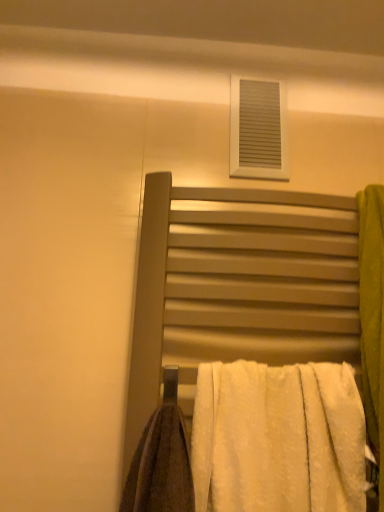
The image size is (384, 512). Identify the location of white matte vent at upper center. (258, 129).

Which is more to the left, matte metal towel rack at center or white fluffy towel at center?

matte metal towel rack at center is more to the left.

Consider the image. Are matte metal towel rack at center and white fluffy towel at center making contact?

They are not placed beside each other.

Which is behind, point (157, 368) or point (225, 474)?

Point (157, 368)

Considering the relative sizes of white matte vent at upper center and white fluffy towel at center in the image provided, is white matte vent at upper center wider than white fluffy towel at center?

Incorrect, the width of white matte vent at upper center does not surpass that of white fluffy towel at center.

From a real-world perspective, who is located lower, white matte vent at upper center or white fluffy towel at center?

white fluffy towel at center is physically lower.

This screenshot has height=512, width=384. Find the location of `window located above the white fluffy towel at center (from the image's perspective)`. window located above the white fluffy towel at center (from the image's perspective) is located at coordinates (258, 129).

In terms of height, does white matte vent at upper center look taller or shorter compared to white fluffy towel at center?

Clearly, white matte vent at upper center is shorter compared to white fluffy towel at center.

Does matte metal towel rack at center have a smaller size compared to white matte vent at upper center?

No, matte metal towel rack at center is not smaller than white matte vent at upper center.

Between matte metal towel rack at center and white matte vent at upper center, which one is positioned in front?

Positioned in front is matte metal towel rack at center.

Is matte metal towel rack at center not close to white matte vent at upper center?

No, matte metal towel rack at center is not far from white matte vent at upper center.

Does matte metal towel rack at center have a lesser width compared to white matte vent at upper center?

No, matte metal towel rack at center is not thinner than white matte vent at upper center.

Is white fluffy towel at center positioned beyond the bounds of white matte vent at upper center?

Absolutely, white fluffy towel at center is external to white matte vent at upper center.

Considering the relative sizes of white fluffy towel at center and white matte vent at upper center in the image provided, is white fluffy towel at center bigger than white matte vent at upper center?

Indeed, white fluffy towel at center has a larger size compared to white matte vent at upper center.

From the picture: Could you tell me if white fluffy towel at center is facing white matte vent at upper center?

No, white fluffy towel at center does not turn towards white matte vent at upper center.

Measure the distance between white fluffy towel at center and white matte vent at upper center.

A distance of 21.66 inches exists between white fluffy towel at center and white matte vent at upper center.

How different are the orientations of white matte vent at upper center and matte metal towel rack at center in degrees?

white matte vent at upper center and matte metal towel rack at center are facing 1.13 degrees away from each other.

From the picture: Would you consider white matte vent at upper center to be distant from matte metal towel rack at center?

No, white matte vent at upper center is not far from matte metal towel rack at center.

Between white matte vent at upper center and matte metal towel rack at center, which one has more height?

matte metal towel rack at center.

Can you confirm if white matte vent at upper center is bigger than matte metal towel rack at center?

Incorrect, white matte vent at upper center is not larger than matte metal towel rack at center.

Who is shorter, white fluffy towel at center or matte metal towel rack at center?

With less height is white fluffy towel at center.

Is white fluffy towel at center placed right next to matte metal towel rack at center?

There is a gap between white fluffy towel at center and matte metal towel rack at center.

Is white fluffy towel at center to the left or to the right of matte metal towel rack at center in the image?

In the image, white fluffy towel at center appears on the right side of matte metal towel rack at center.

From the image's perspective, is white fluffy towel at center on top of matte metal towel rack at center?

Incorrect, from the image's perspective, white fluffy towel at center is lower than matte metal towel rack at center.

Find the location of a particular element. towel on the right of the matte metal towel rack at center is located at coordinates (278, 438).

Locate an element on the screen. The width and height of the screenshot is (384, 512). towel lying below the white matte vent at upper center (from the image's perspective) is located at coordinates (278, 438).

Estimate the real-world distances between objects in this image. Which object is closer to white matte vent at upper center, matte metal towel rack at center or white fluffy towel at center?

Among the two, matte metal towel rack at center is located nearer to white matte vent at upper center.

When comparing their distances from white fluffy towel at center, does matte metal towel rack at center or white matte vent at upper center seem closer?

matte metal towel rack at center is closer to white fluffy towel at center.

Considering their positions, is white matte vent at upper center positioned further to white fluffy towel at center than matte metal towel rack at center?

white matte vent at upper center lies further to white fluffy towel at center than the other object.

Estimate the real-world distances between objects in this image. Which object is closer to white matte vent at upper center, white fluffy towel at center or matte metal towel rack at center?

Based on the image, matte metal towel rack at center appears to be nearer to white matte vent at upper center.

Which object lies further to the anchor point matte metal towel rack at center, white fluffy towel at center or white matte vent at upper center?

white matte vent at upper center is further to matte metal towel rack at center.

Looking at the image, which one is located further to matte metal towel rack at center, white matte vent at upper center or white fluffy towel at center?

The object further to matte metal towel rack at center is white matte vent at upper center.

This screenshot has height=512, width=384. I want to click on bed between white matte vent at upper center and white fluffy towel at center from top to bottom, so click(239, 285).